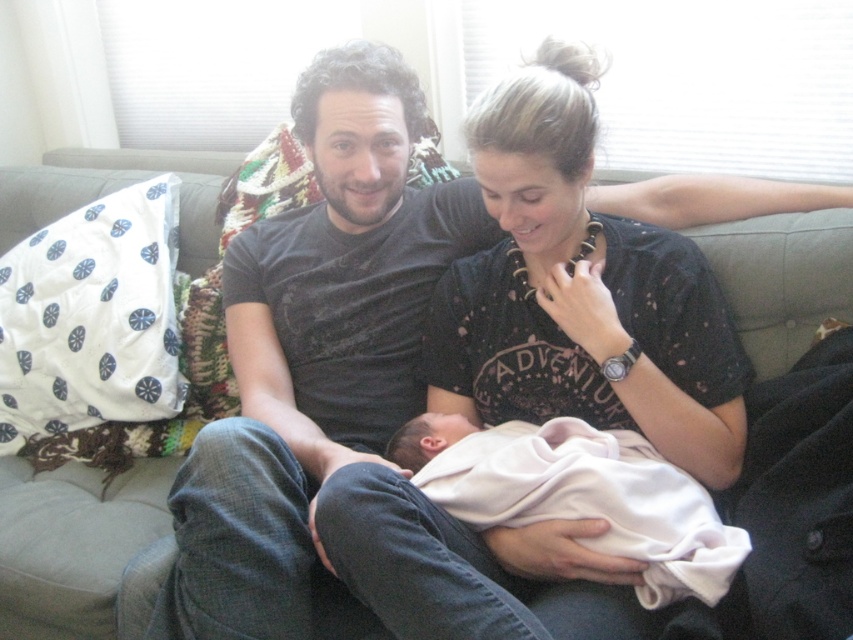
Question: Is black dotted shirt at center wider than pink soft fabric newborn at center?

Choices:
 (A) yes
 (B) no

Answer: (A)

Question: Is black dotted shirt at center thinner than pink soft fabric newborn at center?

Choices:
 (A) no
 (B) yes

Answer: (A)

Question: Considering the relative positions of black dotted shirt at center and pink soft fabric newborn at center in the image provided, where is black dotted shirt at center located with respect to pink soft fabric newborn at center?

Choices:
 (A) left
 (B) right

Answer: (A)

Question: Which object appears farthest from the camera in this image?

Choices:
 (A) black dotted shirt at center
 (B) pink soft fabric newborn at center

Answer: (A)